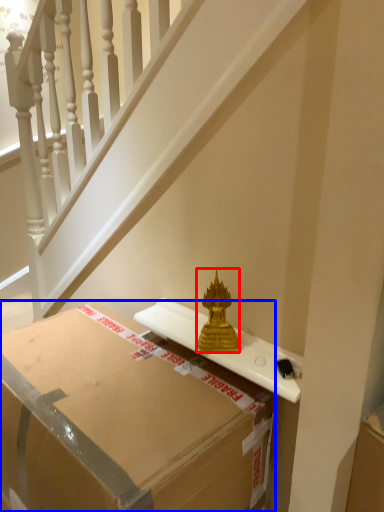
Question: Which object appears farthest to the camera in this image, sculpture (highlighted by a red box) or box (highlighted by a blue box)?

Choices:
 (A) sculpture
 (B) box

Answer: (A)